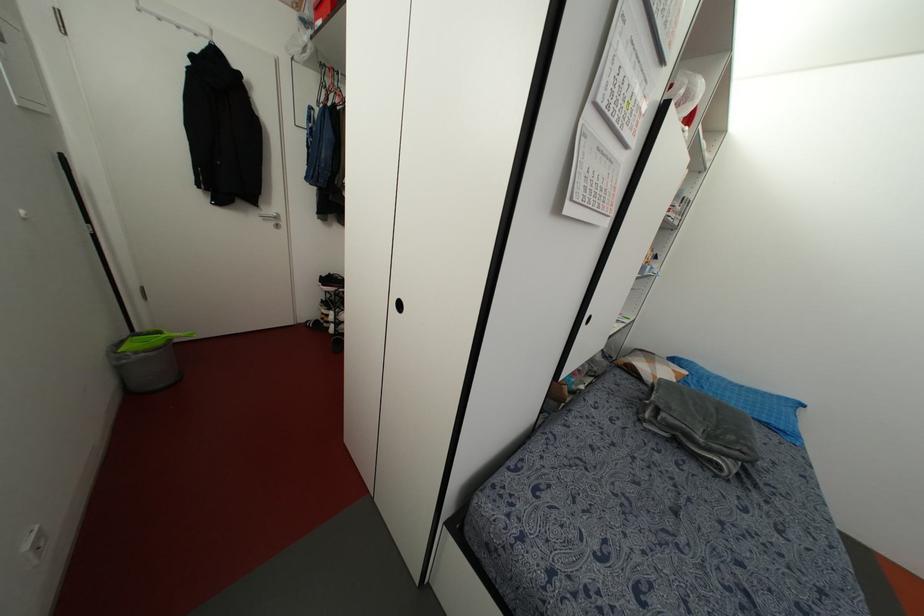
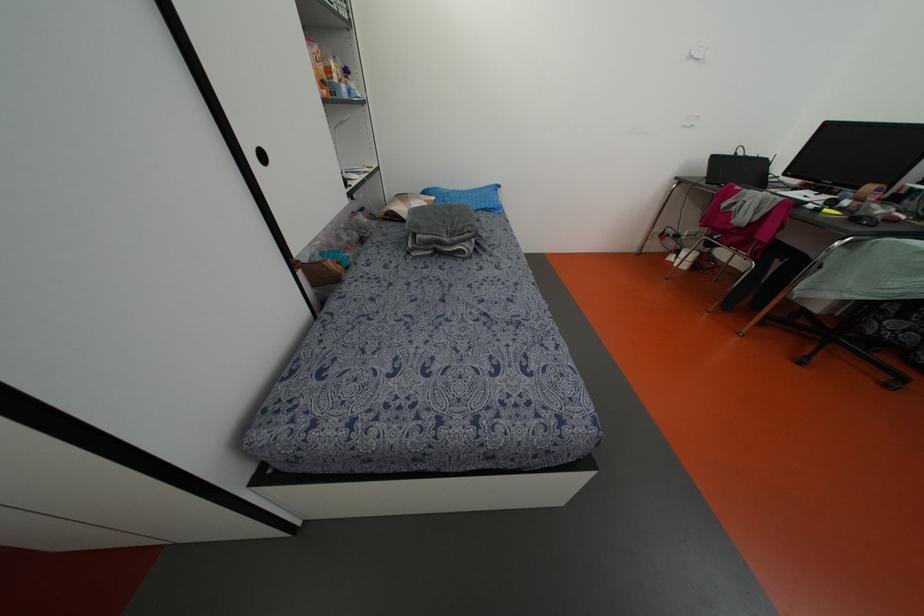
The point at (647, 354) is marked in the first image. Where is the corresponding point in the second image?

(402, 197)